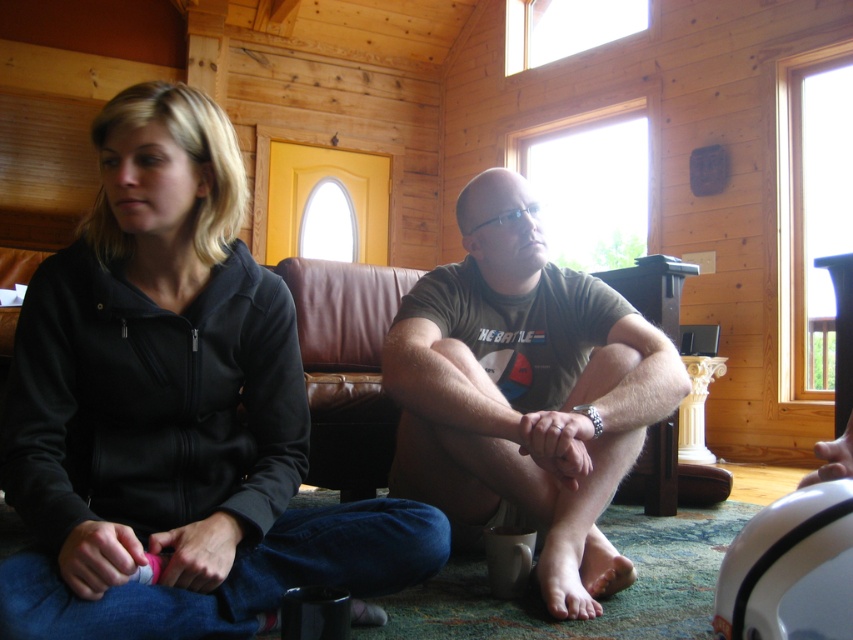
You are standing in the cabin and want to place a small plant pot exactly at the point marked as point [172,410]. What object is already located there that you need to move before placing the pot?

The black fleece jacket at center is located at point [172,410], so you need to move it to place the plant pot there.